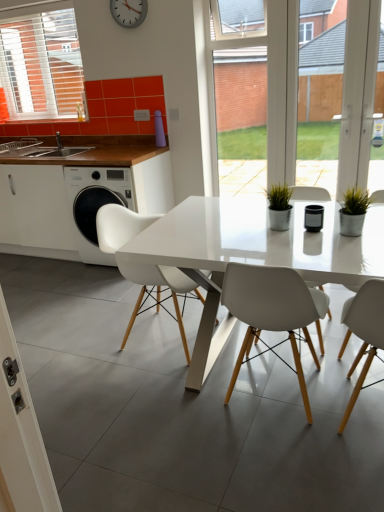
Question: From a real-world perspective, is white glossy table at center over silver metallic clock at upper center?

Choices:
 (A) no
 (B) yes

Answer: (A)

Question: From a real-world perspective, is white glossy table at center located beneath silver metallic clock at upper center?

Choices:
 (A) yes
 (B) no

Answer: (A)

Question: Does white glossy table at center appear on the left side of silver metallic clock at upper center?

Choices:
 (A) no
 (B) yes

Answer: (A)

Question: Is white glossy table at center not close to silver metallic clock at upper center?

Choices:
 (A) yes
 (B) no

Answer: (A)

Question: Does white glossy table at center have a lesser height compared to silver metallic clock at upper center?

Choices:
 (A) yes
 (B) no

Answer: (B)

Question: Which is correct: silver metallic clock at upper center is inside white matte chair at center, positioned as the 1th chair in right-to-left order, or outside of it?

Choices:
 (A) inside
 (B) outside

Answer: (B)

Question: From the image's perspective, is silver metallic clock at upper center located above or below white matte chair at center, the second chair from the left?

Choices:
 (A) above
 (B) below

Answer: (A)

Question: From a real-world perspective, is silver metallic clock at upper center physically located above or below white matte chair at center, the second chair from the left?

Choices:
 (A) above
 (B) below

Answer: (A)

Question: From their relative heights in the image, would you say silver metallic clock at upper center is taller or shorter than white matte chair at center, the second chair from the left?

Choices:
 (A) short
 (B) tall

Answer: (A)

Question: From their relative heights in the image, would you say white plastic chair at center, which is the second chair in right-to-left order, is taller or shorter than white matte chair at center, the second chair from the left?

Choices:
 (A) tall
 (B) short

Answer: (A)

Question: From the image's perspective, is white plastic chair at center, acting as the first chair starting from the left, positioned above or below white matte chair at center, the second chair from the left?

Choices:
 (A) below
 (B) above

Answer: (B)

Question: Based on their positions, is white plastic chair at center, which is the second chair in right-to-left order, located to the left or right of white matte chair at center, positioned as the 1th chair in right-to-left order?

Choices:
 (A) right
 (B) left

Answer: (B)

Question: From a real-world perspective, is white plastic chair at center, acting as the first chair starting from the left, physically located above or below white matte chair at center, the second chair from the left?

Choices:
 (A) above
 (B) below

Answer: (A)

Question: From their relative heights in the image, would you say transparent glass door at center is taller or shorter than white plastic chair at center, acting as the first chair starting from the left?

Choices:
 (A) short
 (B) tall

Answer: (B)

Question: Considering the positions of transparent glass door at center and white plastic chair at center, which is the second chair in right-to-left order, in the image, is transparent glass door at center bigger or smaller than white plastic chair at center, which is the second chair in right-to-left order,?

Choices:
 (A) small
 (B) big

Answer: (A)